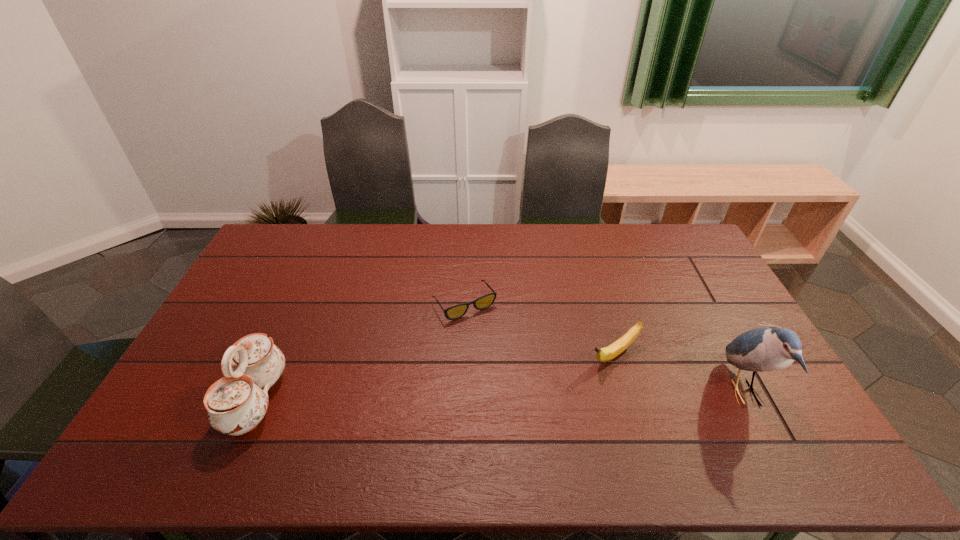
Find the location of a particular element. vacant space on the desktop that is between the chinaware and the bird and is positioned at the stem of the third tallest object is located at coordinates (558, 395).

Identify the location of free spot on the desktop that is between the chinaware and the tallest object and is positioned on the front-facing side of the farthest object. The height and width of the screenshot is (540, 960). (527, 395).